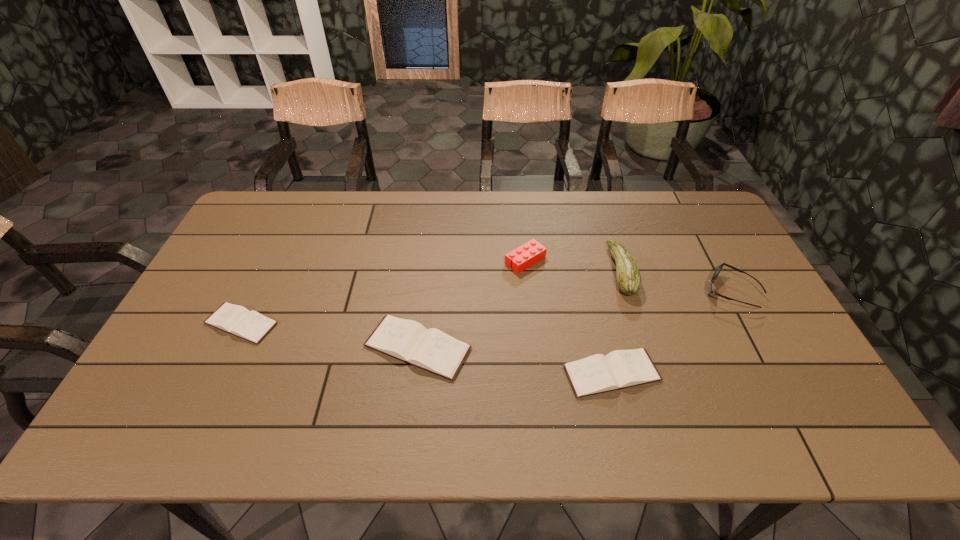
At what (x,y) coordinates should I click in order to perform the action: click on the leftmost object. Please return your answer as a coordinate pair (x, y). Looking at the image, I should click on (234, 319).

This screenshot has height=540, width=960. What are the coordinates of `the leftmost diary` in the screenshot? It's located at (234, 319).

The image size is (960, 540). I want to click on the second diary from right to left, so click(x=409, y=341).

Where is `the fifth tallest object`? the fifth tallest object is located at coordinates (619, 369).

This screenshot has height=540, width=960. What are the coordinates of `the second tallest diary` in the screenshot? It's located at (619, 369).

What are the coordinates of `the rightmost object` in the screenshot? It's located at (719, 268).

Image resolution: width=960 pixels, height=540 pixels. In order to click on the tallest object in this screenshot , I will do 629,281.

Image resolution: width=960 pixels, height=540 pixels. Identify the location of the fourth object from right to left. (528, 254).

At what (x,y) coordinates should I click in order to perform the action: click on free space located on the back of the shortest diary. Please return your answer as a coordinate pair (x, y). This screenshot has height=540, width=960. Looking at the image, I should click on (269, 264).

You are a GUI agent. You are given a task and a screenshot of the screen. Output one action in this format:
    pyautogui.click(x=<x>, y=<y>)
    Task: Click on the free region located on the back of the fifth object from right to left
    
    Given the screenshot: What is the action you would take?
    pyautogui.click(x=425, y=285)